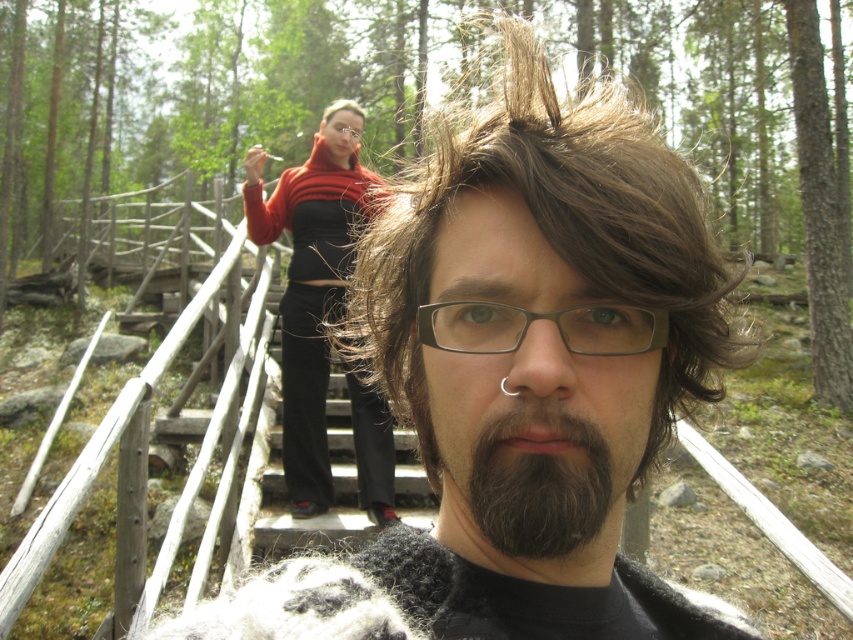
Question: Is green matte forest at upper center positioned in front of dark brown fuzzy beard at center?

Choices:
 (A) no
 (B) yes

Answer: (A)

Question: Which of the following is the closest to the observer?

Choices:
 (A) orange sweater at center
 (B) dark brown fuzzy beard at center
 (C) green matte forest at upper center
 (D) brown wavy hair at center

Answer: (B)

Question: Estimate the real-world distances between objects in this image. Which object is closer to the brown wavy hair at center?

Choices:
 (A) green matte forest at upper center
 (B) dark brown fuzzy beard at center

Answer: (B)

Question: Can you confirm if green matte forest at upper center is bigger than orange sweater at center?

Choices:
 (A) no
 (B) yes

Answer: (B)

Question: Estimate the real-world distances between objects in this image. Which object is farther from the black plastic glasses at center?

Choices:
 (A) green matte forest at upper center
 (B) dark brown fuzzy beard at center
 (C) orange sweater at center
 (D) brown wavy hair at center

Answer: (A)

Question: Considering the relative positions of orange sweater at center and black plastic glasses at center in the image provided, where is orange sweater at center located with respect to black plastic glasses at center?

Choices:
 (A) left
 (B) right

Answer: (A)